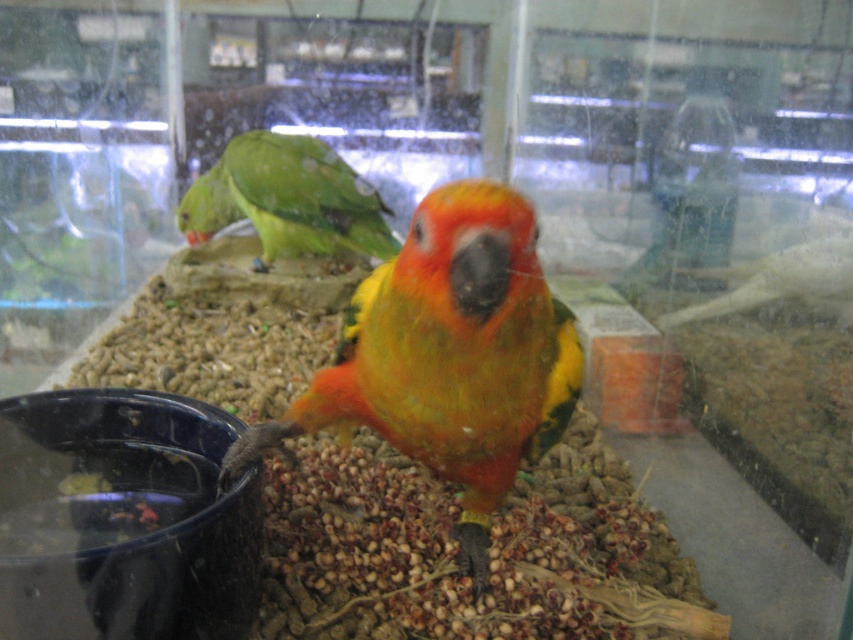
Between point (395, 416) and point (299, 196), which one is positioned in front?

Positioned in front is point (395, 416).

Is yellow-green parrot at center behind green matte parrot at upper left?

No.

Is point (476, 572) closer to viewer compared to point (206, 218)?

That is True.

Where is `yellow-green parrot at center`? The height and width of the screenshot is (640, 853). yellow-green parrot at center is located at coordinates (450, 356).